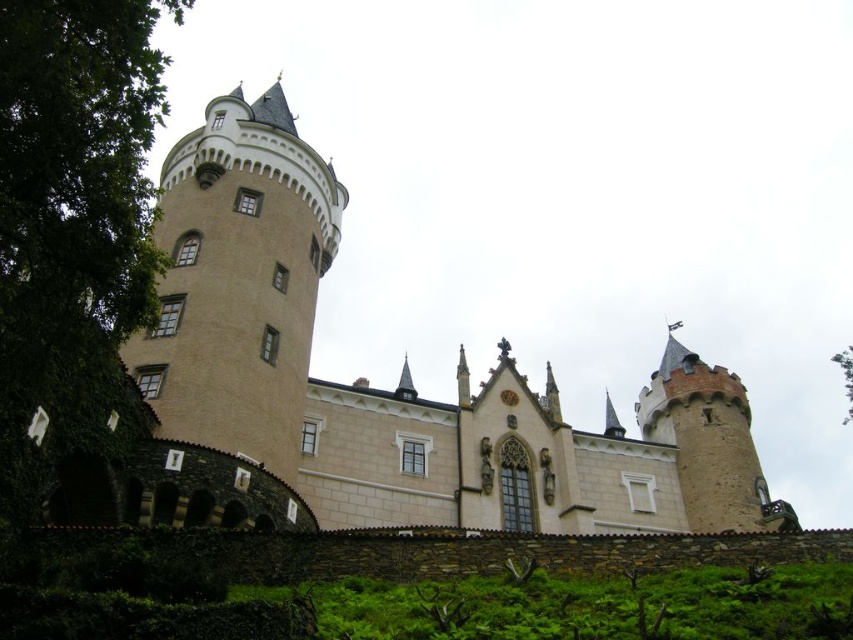
Question: Can you confirm if white stone tower at center-left is positioned to the right of green leafy tree at upper right?

Choices:
 (A) yes
 (B) no

Answer: (B)

Question: Which object is positioned closest to the beige stone castle at center?

Choices:
 (A) green leafy tree at left
 (B) white stone tower at center-left

Answer: (B)

Question: Which point is farther to the camera?

Choices:
 (A) coord(4,422)
 (B) coord(833,355)
 (C) coord(207,188)

Answer: (B)

Question: Among these objects, which one is nearest to the camera?

Choices:
 (A) white stone tower at center-left
 (B) beige stone castle at center
 (C) green leafy tree at left

Answer: (C)

Question: Is beige stone castle at center to the left of green leafy tree at upper right from the viewer's perspective?

Choices:
 (A) yes
 (B) no

Answer: (A)

Question: Is green leafy tree at left to the left of white stone tower at center-left from the viewer's perspective?

Choices:
 (A) no
 (B) yes

Answer: (B)